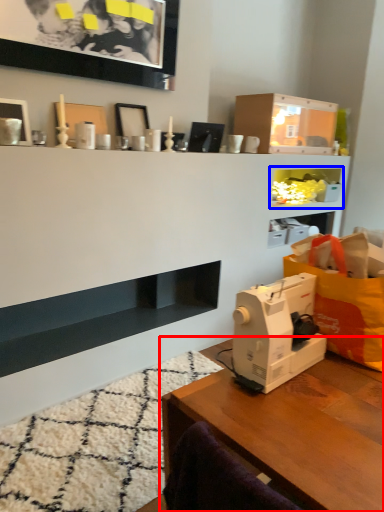
Question: Which object is closer to the camera taking this photo, table (highlighted by a red box) or cabinet (highlighted by a blue box)?

Choices:
 (A) table
 (B) cabinet

Answer: (A)